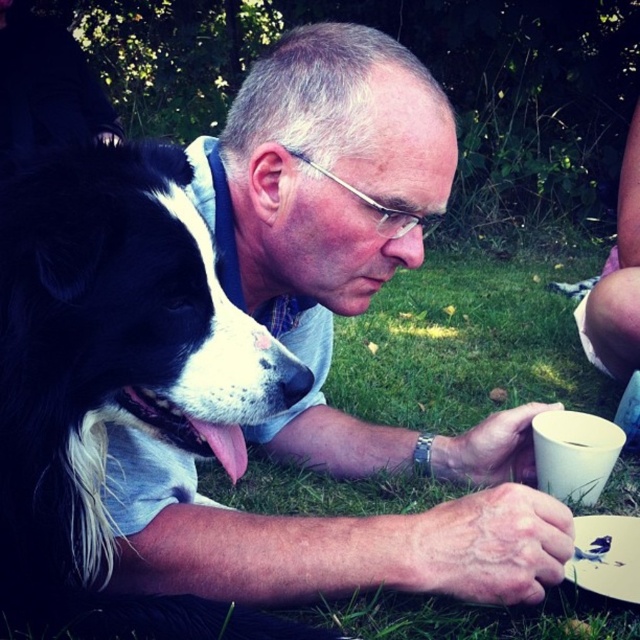
You are a photographer trying to capture a photo of the black fur dog at center and the white matte cup at lower right. If you want to ensure both are in focus, which one should you focus on first?

The black fur dog at center is taller than the white matte cup at lower right, so you should focus on the black fur dog at center first to ensure both are in focus.